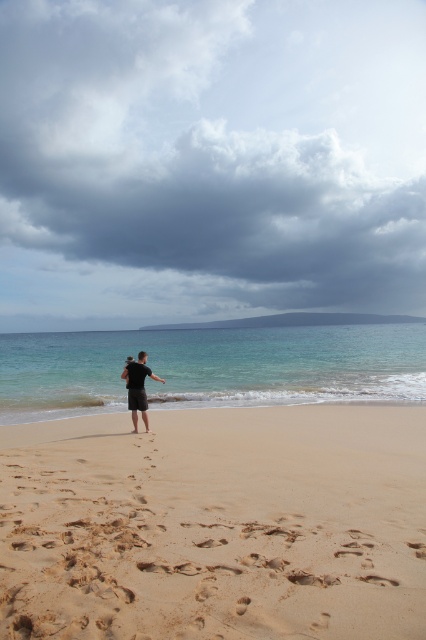
Question: Is brown sandy beach at center wider than dark brown shorts at center?

Choices:
 (A) no
 (B) yes

Answer: (B)

Question: Can you confirm if cloudy sky at upper center is positioned above brown sandy beach at center?

Choices:
 (A) no
 (B) yes

Answer: (B)

Question: Which of these objects is positioned farthest from the dark brown shorts at center?

Choices:
 (A) brown sandy beach at center
 (B) cloudy sky at upper center

Answer: (B)

Question: Which point appears closest to the camera in this image?

Choices:
 (A) (256, 177)
 (B) (80, 420)
 (C) (141, 369)

Answer: (C)

Question: Which point is farther to the camera?

Choices:
 (A) dark brown shorts at center
 (B) brown sandy beach at center

Answer: (A)

Question: Can you confirm if brown sandy beach at center is thinner than dark brown shorts at center?

Choices:
 (A) yes
 (B) no

Answer: (B)